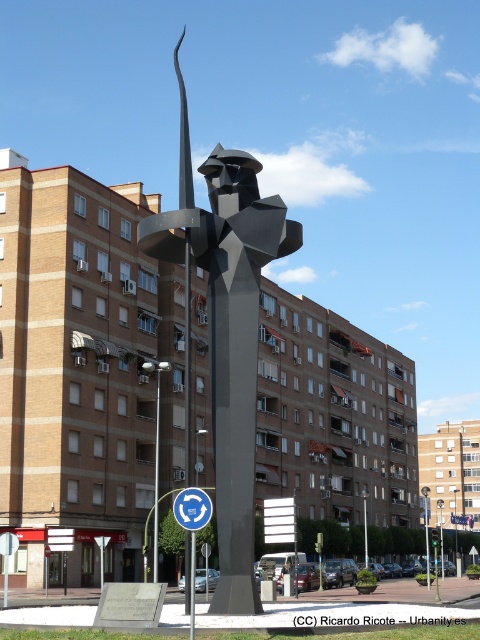
You are standing in front of the sculpture and want to take a photo. You notice two points marked on the sculpture at coordinates point (220, 365) and point (182, 524). Which point is closer to your camera lens when taking the photo?

Point (182, 524) is closer to the camera lens because it is less further away than point (220, 365), which is further away from the camera.

You are standing at the base of the polished steel sculpture at center in the urban scene. You want to walk straight towards the blue circular sign at center. How far will you have to walk to reach it?

The polished steel sculpture at center is 137.61 meters away from the blue circular sign at center, so you will have to walk 137.61 meters to reach it.

You are a city planner assessing the space between the polished steel sculpture at center and the blue circular sign at center. If the sign is 2 meters wide, what is the minimum width of the sculpture to ensure it is wider than the sign?

The polished steel sculpture at center is wider than the blue circular sign at center. Since the sign is 2 meters wide, the sculpture must be at least 2.01 meters wide to be wider.